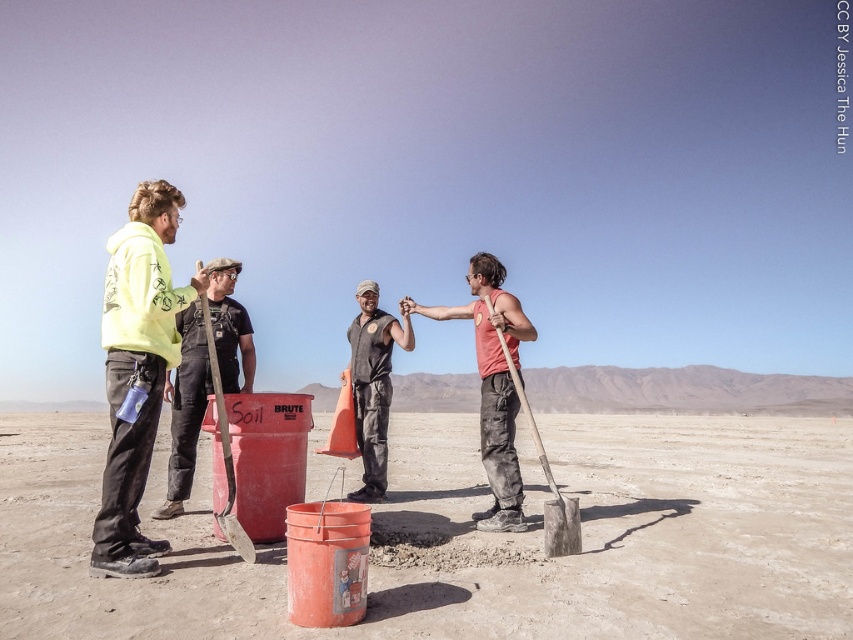
You are a hiker standing at the edge of the desert and see the dirt field at center and the matte red shirt at center. Which object is taller from your perspective?

The matte red shirt at center is taller than the dirt field at center.

What is located at the coordinates point (476,538) in the desert scene?

The dirt field at center is located at point (476,538).

You are a photographer trying to capture a group photo of the yellow hoodie at left and the dark gray uniform at center. Since you want to include both in the frame, which side should you stand relative to the group to ensure both are fully visible?

The yellow hoodie at left is positioned on the left side of dark gray uniform at center, so you should stand to the right side of the group to ensure both are fully visible.